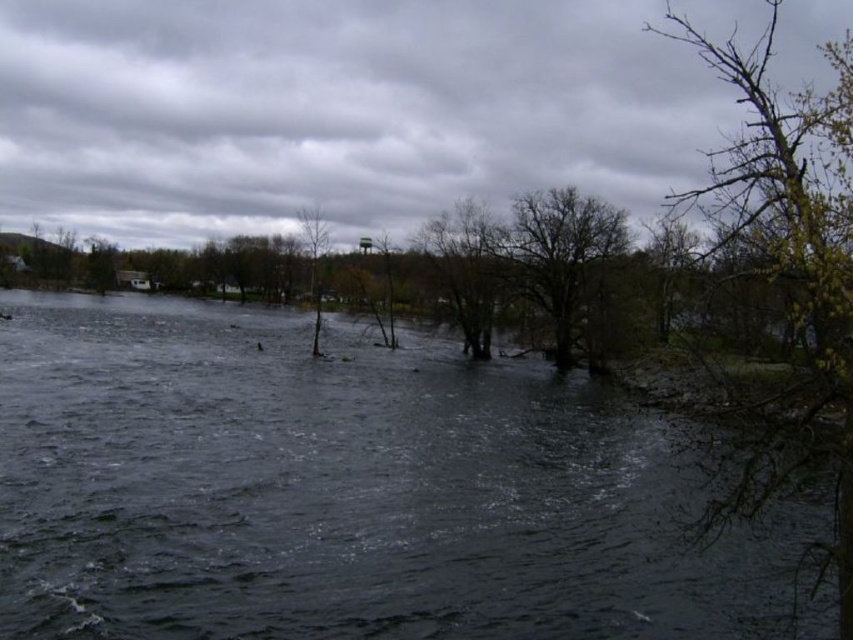
You are a bird looking for a perch. You see a bare branches tree at center and a brown rough tree at center. Which tree is taller and would provide a higher vantage point?

The bare branches tree at center is taller than the brown rough tree at center, so it would provide a higher vantage point.